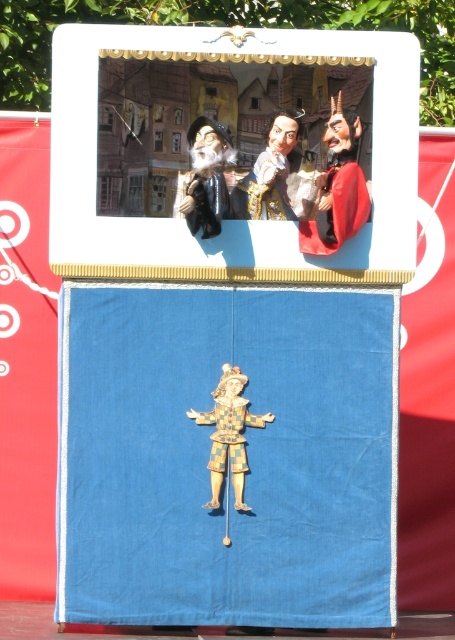
Question: Which point appears closest to the camera in this image?

Choices:
 (A) (181, 349)
 (B) (282, 136)
 (C) (355, 202)

Answer: (C)

Question: Which of these objects is positioned farthest from the blue fabric puppet at center?

Choices:
 (A) wooden clown at center
 (B) smooth red mask at upper right
 (C) smooth leather mask at upper center

Answer: (C)

Question: Is blue fabric puppet at center above smooth red mask at upper right?

Choices:
 (A) yes
 (B) no

Answer: (B)

Question: Among these points, which one is farthest from the camera?

Choices:
 (A) (312, 252)
 (B) (272, 150)

Answer: (B)

Question: Does blue fabric puppet at center come behind smooth leather mask at upper center?

Choices:
 (A) no
 (B) yes

Answer: (A)

Question: Does smooth red mask at upper right appear on the left side of matte black puppet at upper center?

Choices:
 (A) yes
 (B) no

Answer: (B)